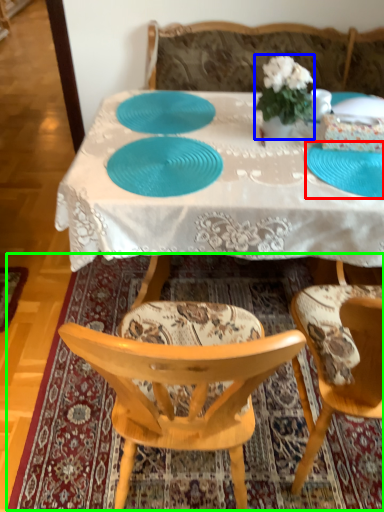
Question: Based on their relative distances, which object is farther from plate (highlighted by a red box)? Choose from houseplant (highlighted by a blue box) and mat (highlighted by a green box).

Choices:
 (A) houseplant
 (B) mat

Answer: (B)